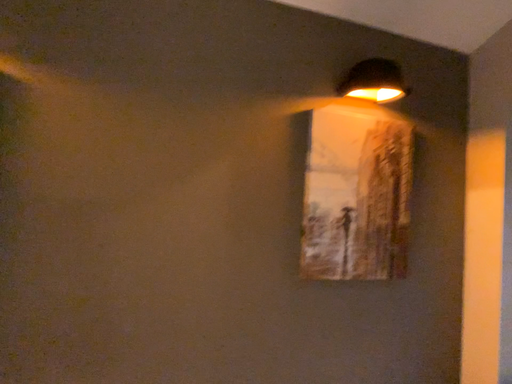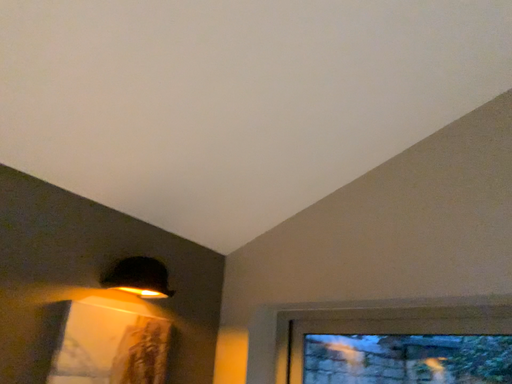
Question: Which way did the camera rotate in the video?

Choices:
 (A) rotated downward
 (B) rotated upward

Answer: (B)